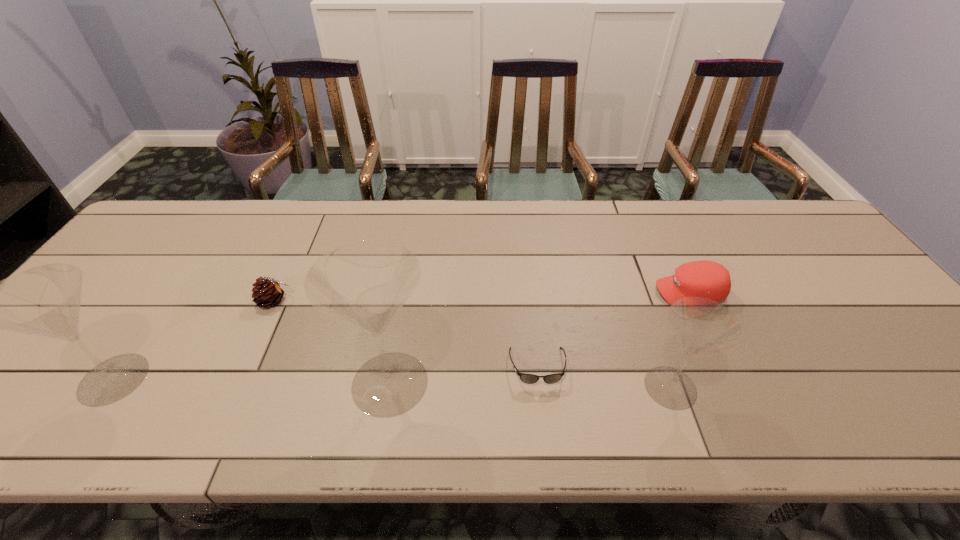
In the image, there is a desktop. Where is `vacant space at the far edge`? vacant space at the far edge is located at coordinates (227, 214).

Find the location of `vacant space at the near edge of the desktop`. vacant space at the near edge of the desktop is located at coordinates (718, 366).

The height and width of the screenshot is (540, 960). In the image, there is a desktop. What are the coordinates of `free region at the left edge` in the screenshot? It's located at tap(115, 299).

What are the coordinates of `free location at the right edge` in the screenshot? It's located at point(817,287).

Where is `vacant space at the far left corner`? This screenshot has width=960, height=540. vacant space at the far left corner is located at coordinates (173, 200).

What are the coordinates of `free spot at the far right corner of the desktop` in the screenshot? It's located at (800, 222).

Find the location of a particular element. vacant point located between the second shortest flute glass and the cap is located at coordinates (401, 335).

Find the location of a particular element. vacant area that lies between the pinecone and the shortest object is located at coordinates tap(406, 334).

The image size is (960, 540). I want to click on vacant point located between the fifth object from right to left and the third tallest object, so click(x=472, y=344).

Locate an element on the screen. vacant space that is in between the sunglasses and the tallest object is located at coordinates (464, 375).